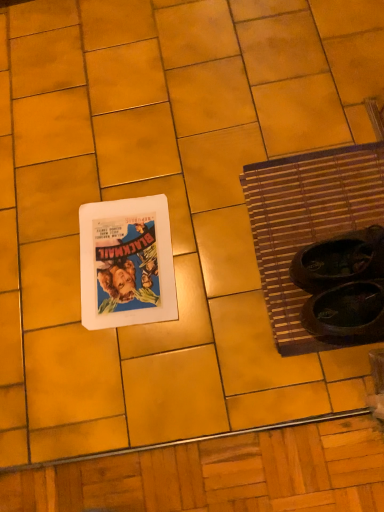
This screenshot has width=384, height=512. I want to click on vacant region above white matte picture frame at center-left (from a real-world perspective), so click(123, 256).